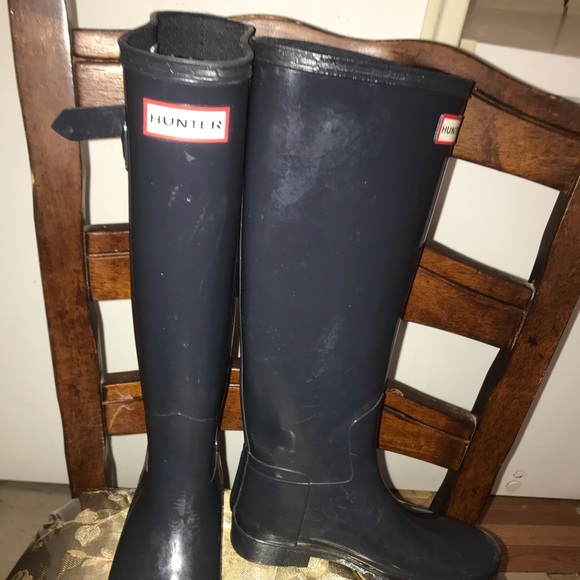
Where is `tile wall surface`? Image resolution: width=580 pixels, height=580 pixels. tile wall surface is located at coordinates (531, 25), (566, 39).